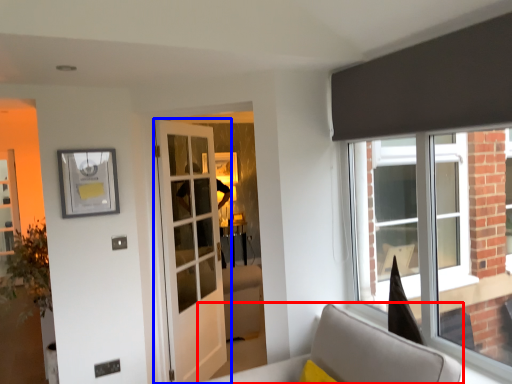
Question: Among these objects, which one is farthest to the camera, furniture (highlighted by a red box) or door (highlighted by a blue box)?

Choices:
 (A) furniture
 (B) door

Answer: (B)